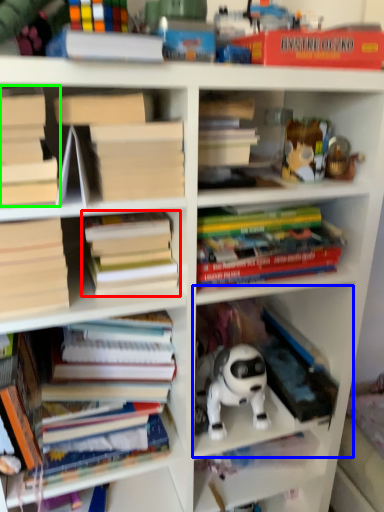
Question: Considering the real-world distances, which object is closest to book (highlighted by a red box)? cabinet (highlighted by a blue box) or book (highlighted by a green box).

Choices:
 (A) cabinet
 (B) book

Answer: (B)